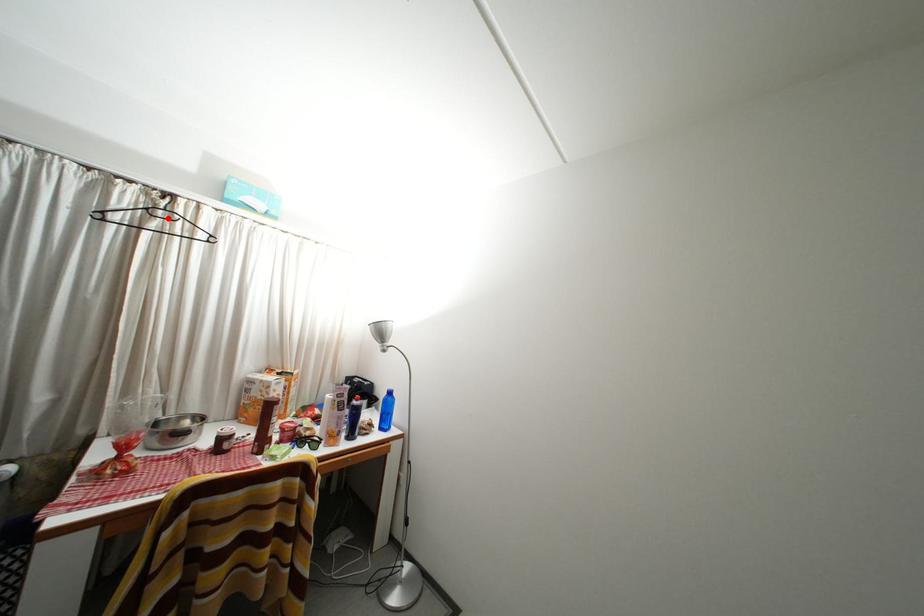
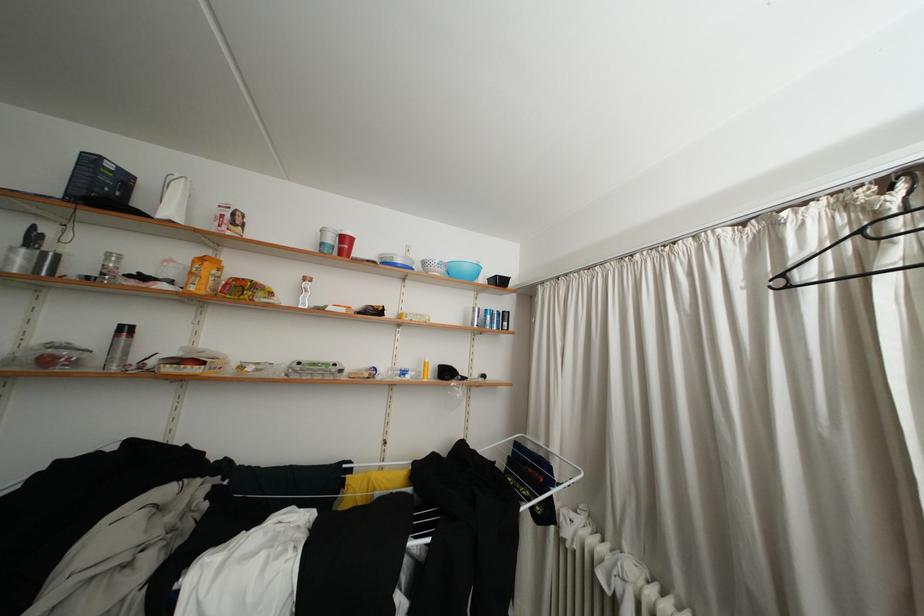
Locate, in the second image, the point that corresponds to the highlighted location in the first image.

(906, 229)